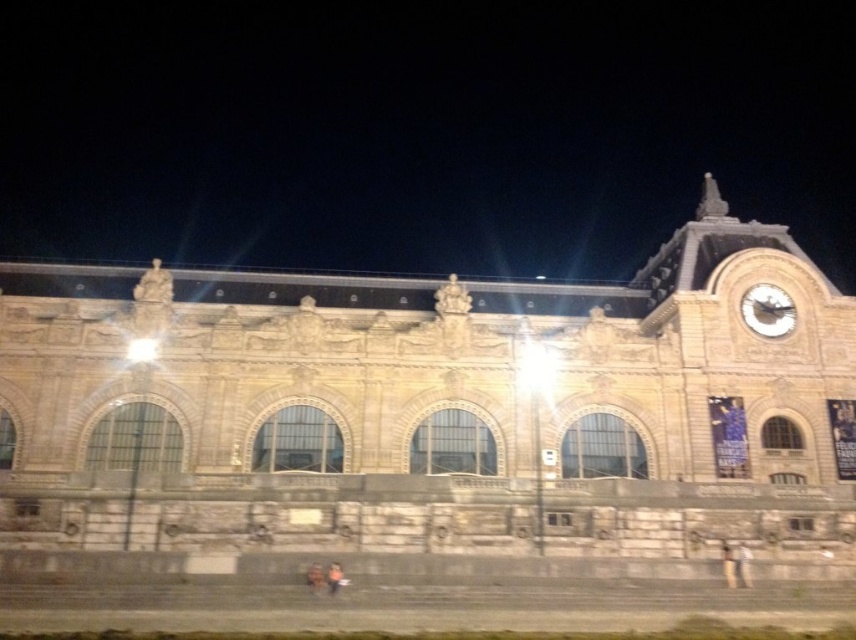
Which is above, dark brown leather jacket at lower center or orange fabric bag at lower center?

dark brown leather jacket at lower center is above.

What do you see at coordinates (316, 577) in the screenshot?
I see `dark brown leather jacket at lower center` at bounding box center [316, 577].

This screenshot has height=640, width=856. In order to click on dark brown leather jacket at lower center in this screenshot , I will do `click(316, 577)`.

Looking at this image, can you confirm if stone clock tower at center is smaller than metallic clock face at upper right?

Actually, stone clock tower at center might be larger than metallic clock face at upper right.

Is stone clock tower at center thinner than metallic clock face at upper right?

In fact, stone clock tower at center might be wider than metallic clock face at upper right.

You are a GUI agent. You are given a task and a screenshot of the screen. Output one action in this format:
    pyautogui.click(x=<x>, y=<y>)
    Task: Click on the stone clock tower at center
    This screenshot has width=856, height=640.
    Given the screenshot: What is the action you would take?
    pyautogui.click(x=420, y=131)

Find the location of `stone clock tower at center`. stone clock tower at center is located at coordinates (420, 131).

Is stone clock tower at center thinner than orange fabric bag at lower center?

No, stone clock tower at center is not thinner than orange fabric bag at lower center.

Which is behind, point (607, 147) or point (330, 572)?

Positioned behind is point (607, 147).

Which is in front, point (57, 198) or point (342, 580)?

Point (342, 580)

Locate an element on the screen. stone clock tower at center is located at coordinates (420, 131).